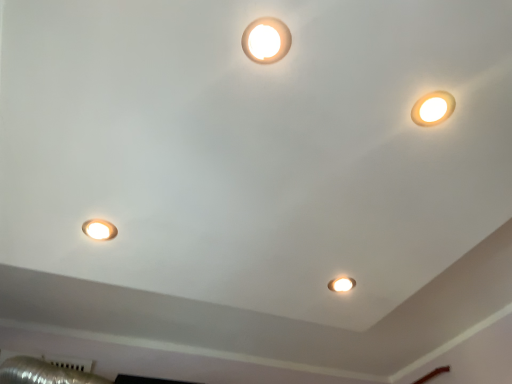
Question: Could you tell me if matte white lamp at upper right, which is counted as the 1th lamp, starting from the right, is turned towards matte white spotlight at center?

Choices:
 (A) yes
 (B) no

Answer: (B)

Question: Can you confirm if matte white lamp at upper right, the third lamp when ordered from left to right, is taller than matte white spotlight at center?

Choices:
 (A) yes
 (B) no

Answer: (B)

Question: From the image's perspective, is matte white lamp at upper right, marked as the second lamp in a front-to-back arrangement, above matte white spotlight at center?

Choices:
 (A) yes
 (B) no

Answer: (A)

Question: Is matte white lamp at upper right, which is counted as the 1th lamp, starting from the right, located outside matte white spotlight at center?

Choices:
 (A) no
 (B) yes

Answer: (B)

Question: Considering the relative positions of matte white lamp at upper right, the 2th lamp positioned from the bottom, and matte white spotlight at center in the image provided, is matte white lamp at upper right, the 2th lamp positioned from the bottom, to the right of matte white spotlight at center from the viewer's perspective?

Choices:
 (A) no
 (B) yes

Answer: (B)

Question: Is matte white lamp at lower left, the 1th lamp from the left, taller or shorter than matte white light fixture at upper center, the first lamp positioned from the front?

Choices:
 (A) tall
 (B) short

Answer: (A)

Question: Is matte white lamp at lower left, positioned as the 3th lamp in top-to-bottom order, to the left or to the right of matte white light fixture at upper center, positioned as the 3th lamp in back-to-front order, in the image?

Choices:
 (A) right
 (B) left

Answer: (B)

Question: Looking at the image, does matte white lamp at lower left, positioned as the 3th lamp in top-to-bottom order, seem bigger or smaller compared to matte white light fixture at upper center, the first lamp positioned from the front?

Choices:
 (A) small
 (B) big

Answer: (A)

Question: Looking at their shapes, would you say matte white lamp at lower left, positioned as the 3th lamp in top-to-bottom order, is wider or thinner than matte white light fixture at upper center, the first lamp positioned from the front?

Choices:
 (A) thin
 (B) wide

Answer: (A)

Question: From a real-world perspective, is matte white lamp at upper right, marked as the second lamp in a front-to-back arrangement, physically located above or below matte white light fixture at upper center, acting as the 3th lamp starting from the bottom?

Choices:
 (A) below
 (B) above

Answer: (A)

Question: From the image's perspective, is matte white lamp at upper right, the third lamp when ordered from left to right, located above or below matte white light fixture at upper center, which appears as the 2th lamp when viewed from the right?

Choices:
 (A) above
 (B) below

Answer: (B)

Question: Considering the positions of matte white lamp at upper right, the third lamp when ordered from left to right, and matte white light fixture at upper center, the 2th lamp from the left, in the image, is matte white lamp at upper right, the third lamp when ordered from left to right, wider or thinner than matte white light fixture at upper center, the 2th lamp from the left,?

Choices:
 (A) thin
 (B) wide

Answer: (A)

Question: In the image, is matte white lamp at upper right, the 2th lamp positioned from the bottom, on the left side or the right side of matte white light fixture at upper center, positioned as the 3th lamp in back-to-front order?

Choices:
 (A) right
 (B) left

Answer: (A)

Question: Is point (350, 283) positioned closer to the camera than point (244, 36)?

Choices:
 (A) farther
 (B) closer

Answer: (A)

Question: Is matte white spotlight at center to the left or to the right of matte white light fixture at upper center, which appears as the first lamp when viewed from the top, in the image?

Choices:
 (A) left
 (B) right

Answer: (B)